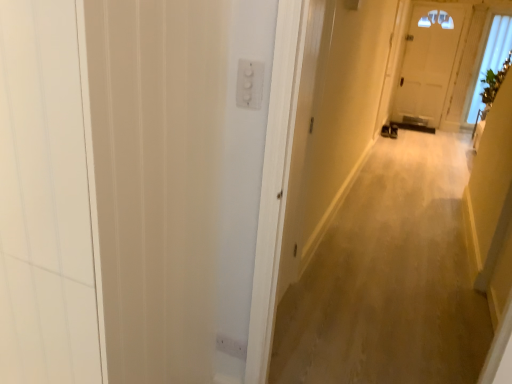
Question: From a real-world perspective, is beige carpet at center positioned above or below white plastic switch at upper center?

Choices:
 (A) below
 (B) above

Answer: (A)

Question: Does point (364, 337) appear closer or farther from the camera than point (247, 66)?

Choices:
 (A) farther
 (B) closer

Answer: (A)

Question: Considering the real-world distances, which object is closest to the beige carpet at center?

Choices:
 (A) white wood screen door at left
 (B) white plastic switch at upper center
 (C) transparent glass window at upper right

Answer: (A)

Question: Which object is the farthest from the beige carpet at center?

Choices:
 (A) white plastic switch at upper center
 (B) transparent glass window at upper right
 (C) white wood screen door at left

Answer: (B)